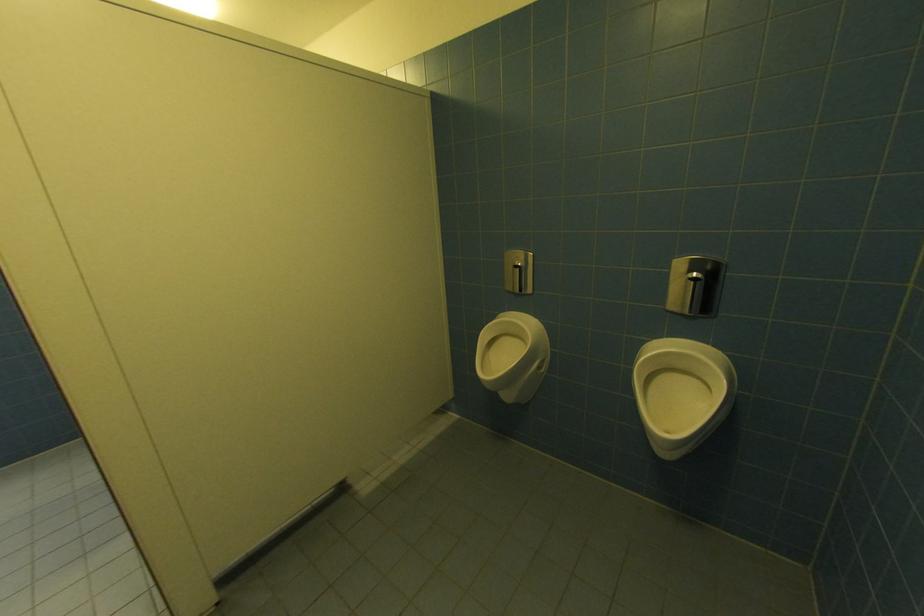
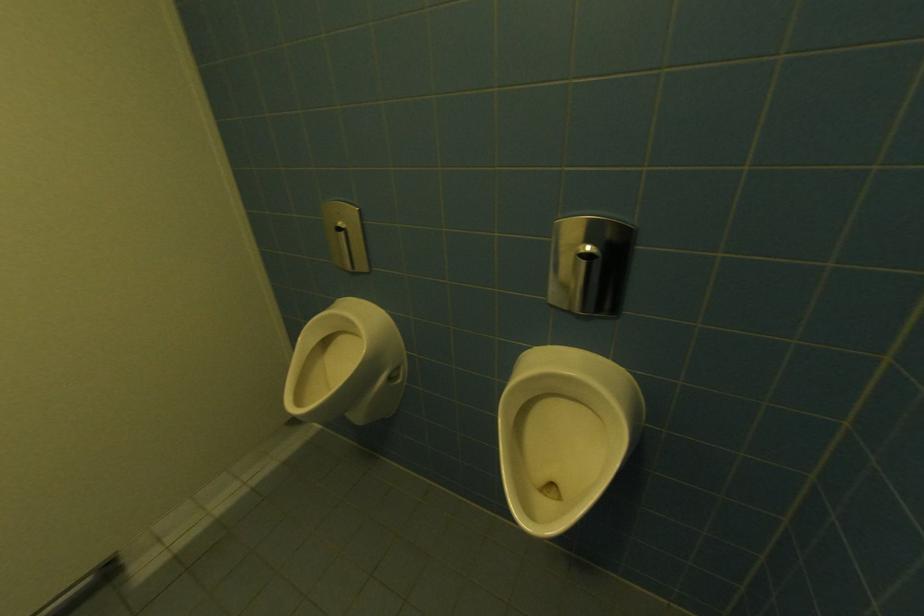
What movement of the cameraman would produce the second image?

The movement direction of the cameraman is right, forward.